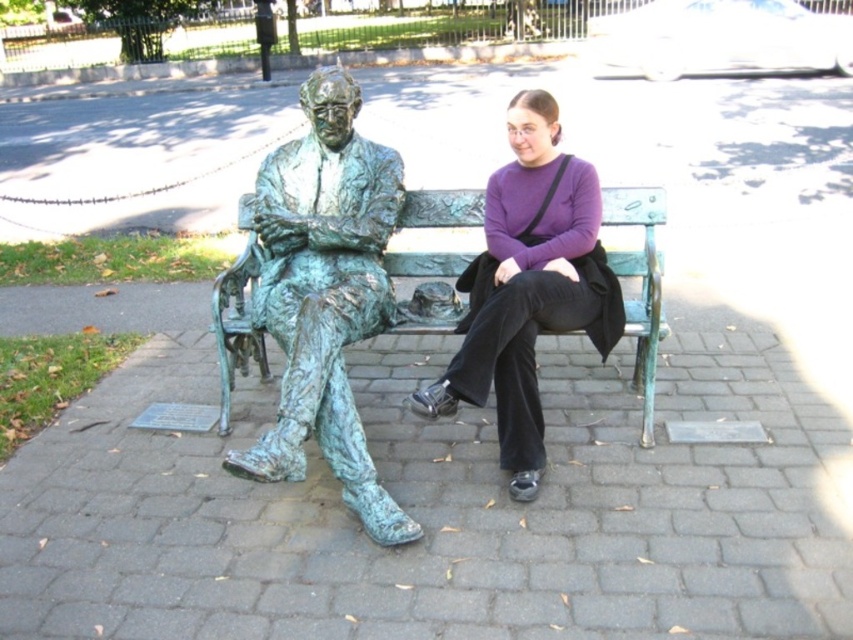
Question: Among these objects, which one is nearest to the camera?

Choices:
 (A) green patina bronze statue at center
 (B) green patina bench at center
 (C) purple matte sweater at center

Answer: (A)

Question: Is green patina bronze statue at center to the left of purple matte sweater at center from the viewer's perspective?

Choices:
 (A) yes
 (B) no

Answer: (A)

Question: Is green patina bronze statue at center above purple matte sweater at center?

Choices:
 (A) no
 (B) yes

Answer: (B)

Question: Does purple matte sweater at center come in front of green patina bench at center?

Choices:
 (A) no
 (B) yes

Answer: (B)

Question: Which of the following is the closest to the observer?

Choices:
 (A) (599, 349)
 (B) (225, 292)
 (C) (343, 76)

Answer: (A)

Question: Based on their relative distances, which object is nearer to the green patina bench at center?

Choices:
 (A) green patina bronze statue at center
 (B) purple matte sweater at center

Answer: (B)